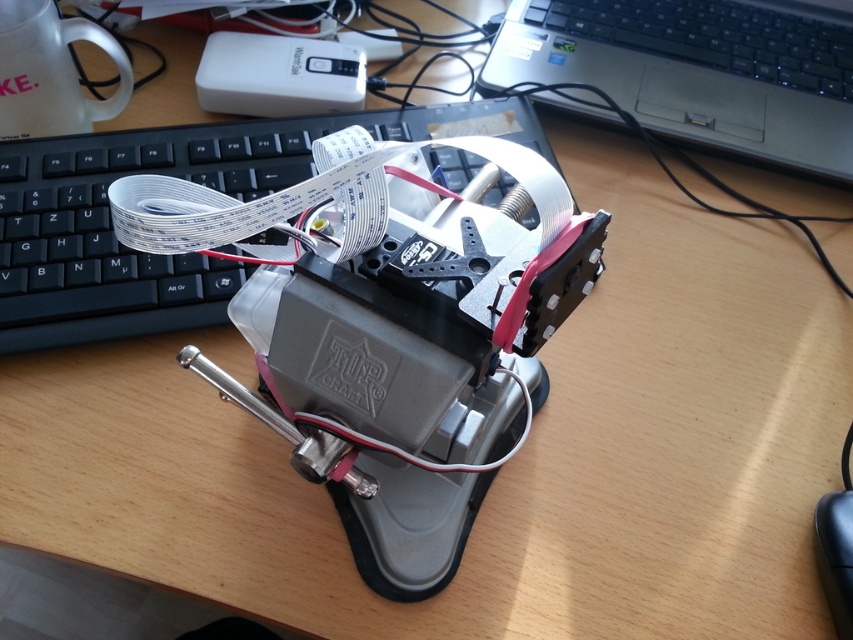
Question: Estimate the real-world distances between objects in this image. Which object is farther from the black plastic keyboard at center?

Choices:
 (A) black plastic mouse at lower right
 (B) silver metallic laptop at upper right

Answer: (A)

Question: Does black plastic keyboard at center have a greater width compared to black plastic mouse at lower right?

Choices:
 (A) yes
 (B) no

Answer: (A)

Question: Is black plastic keyboard at center to the left of black plastic mouse at lower right from the viewer's perspective?

Choices:
 (A) yes
 (B) no

Answer: (A)

Question: Estimate the real-world distances between objects in this image. Which object is closer to the black plastic keyboard at center?

Choices:
 (A) silver metallic laptop at upper right
 (B) black plastic mouse at lower right

Answer: (A)

Question: Does black plastic keyboard at center have a larger size compared to silver metallic laptop at upper right?

Choices:
 (A) no
 (B) yes

Answer: (B)

Question: Estimate the real-world distances between objects in this image. Which object is farther from the black plastic mouse at lower right?

Choices:
 (A) silver metallic laptop at upper right
 (B) black plastic keyboard at center

Answer: (B)